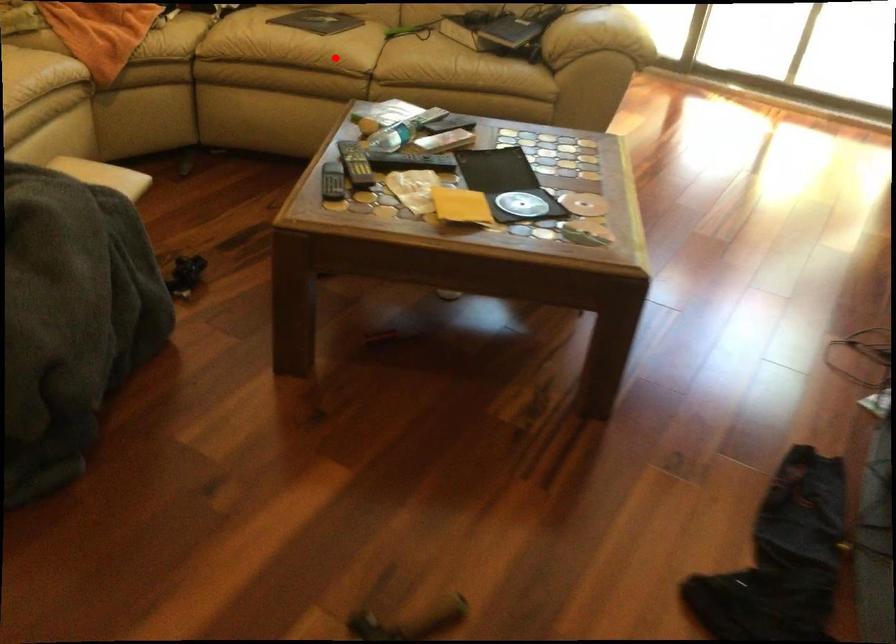
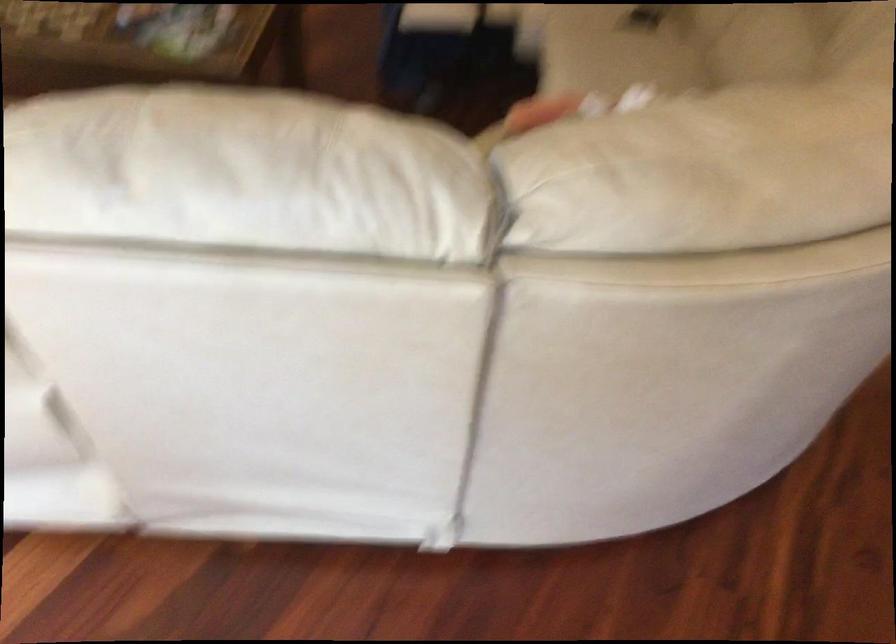
Question: I am providing you with two images of the same scene from different viewpoints. A red point is marked on the first image. At the location where the point appears in image 1, is it still visible in image 2?

Choices:
 (A) Yes
 (B) No

Answer: (B)